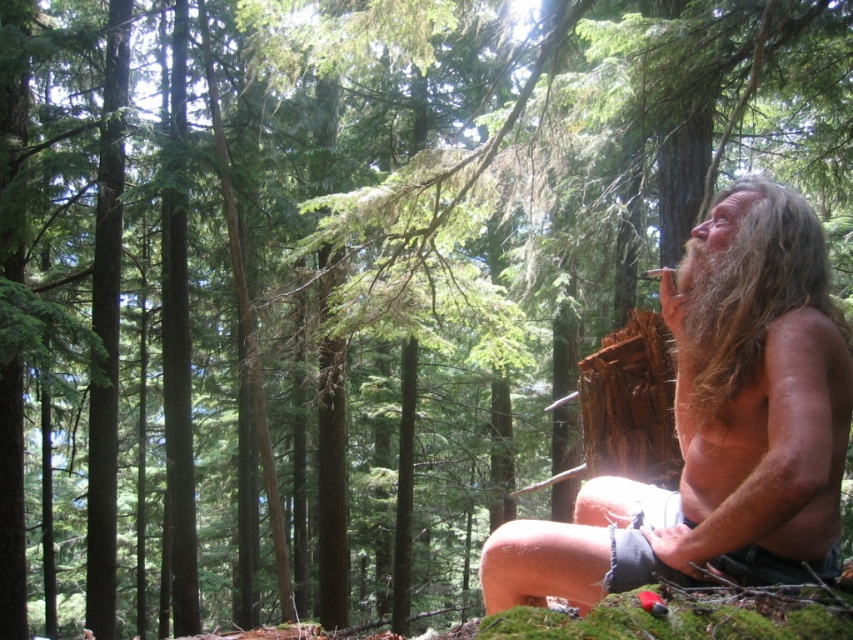
Question: Which point is farther from the camera taking this photo?

Choices:
 (A) (802, 257)
 (B) (764, 243)

Answer: (B)

Question: Can you confirm if brown wavy hair at right is positioned to the left of long brown hair at upper right?

Choices:
 (A) yes
 (B) no

Answer: (B)

Question: Which point is farther to the camera?

Choices:
 (A) (619, 570)
 (B) (727, 244)
 (C) (724, 216)

Answer: (C)

Question: Can you confirm if shaggy hair at right is wider than brown wavy hair at right?

Choices:
 (A) no
 (B) yes

Answer: (B)

Question: Is shaggy hair at right smaller than brown wavy hair at right?

Choices:
 (A) no
 (B) yes

Answer: (A)

Question: Which point appears farthest from the camera in this image?

Choices:
 (A) (712, 333)
 (B) (711, 358)
 (C) (793, 532)

Answer: (A)